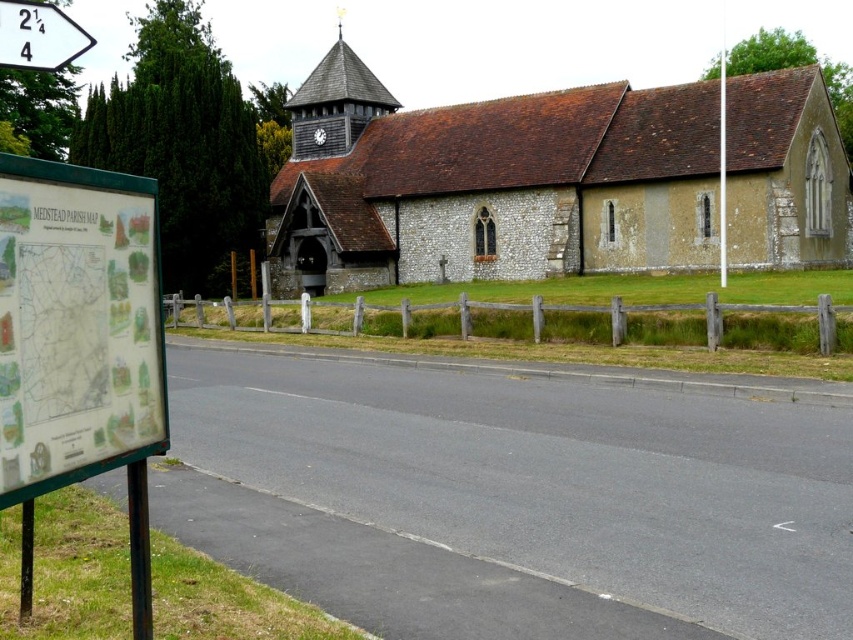
Question: Which is farther from the white plastic arrow at upper left?

Choices:
 (A) brown stone church at center
 (B) wooden shingles spire at upper center

Answer: (B)

Question: Is wooden shingles spire at upper center above white plastic arrow at upper left?

Choices:
 (A) no
 (B) yes

Answer: (B)

Question: Is brown stone church at center below white plastic arrow at upper left?

Choices:
 (A) yes
 (B) no

Answer: (B)

Question: Which of the following is the closest to the observer?

Choices:
 (A) transparent plastic map at lower left
 (B) brown stone church at center
 (C) wooden shingles spire at upper center
 (D) white plastic arrow at upper left

Answer: (A)

Question: Which point is closer to the camera?

Choices:
 (A) white plastic arrow at upper left
 (B) transparent plastic map at lower left

Answer: (B)

Question: Is brown stone church at center bigger than wooden shingles spire at upper center?

Choices:
 (A) yes
 (B) no

Answer: (A)